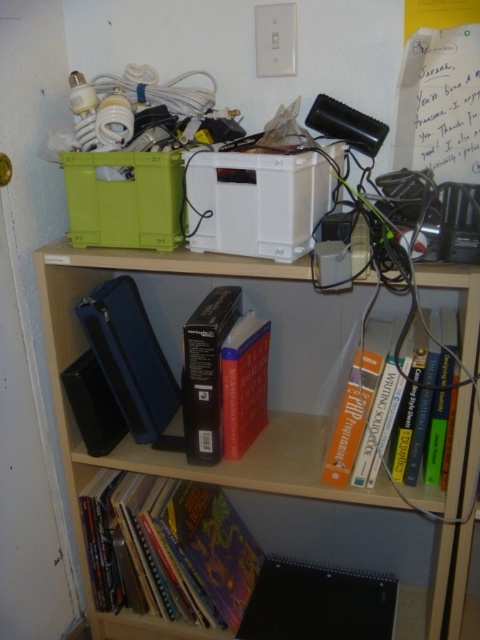
Is wooden bookshelf at center above red matte book at center?

No, wooden bookshelf at center is not above red matte book at center.

Does wooden bookshelf at center have a greater width compared to red matte book at center?

Yes, wooden bookshelf at center is wider than red matte book at center.

Image resolution: width=480 pixels, height=640 pixels. Describe the element at coordinates (181, 452) in the screenshot. I see `wooden bookshelf at center` at that location.

At what (x,y) coordinates should I click in order to perform the action: click on wooden bookshelf at center. Please return your answer as a coordinate pair (x, y). Looking at the image, I should click on (181, 452).

Looking at this image, is wooden bookshelf at center further to the viewer compared to hardcover book at center?

No, it is not.

Which is in front, point (462, 451) or point (351, 461)?

Point (462, 451) is in front.

Find the location of a particular element. This screenshot has width=480, height=640. wooden bookshelf at center is located at coordinates (181, 452).

Which is more to the right, multicolored paperbacks at lower left or hardcover book at center?

hardcover book at center is more to the right.

Is multicolored paperbacks at lower left above hardcover book at center?

Actually, multicolored paperbacks at lower left is below hardcover book at center.

Identify the location of multicolored paperbacks at lower left. Image resolution: width=480 pixels, height=640 pixels. (168, 548).

Where is `multicolored paperbacks at lower left`? The image size is (480, 640). multicolored paperbacks at lower left is located at coordinates (168, 548).